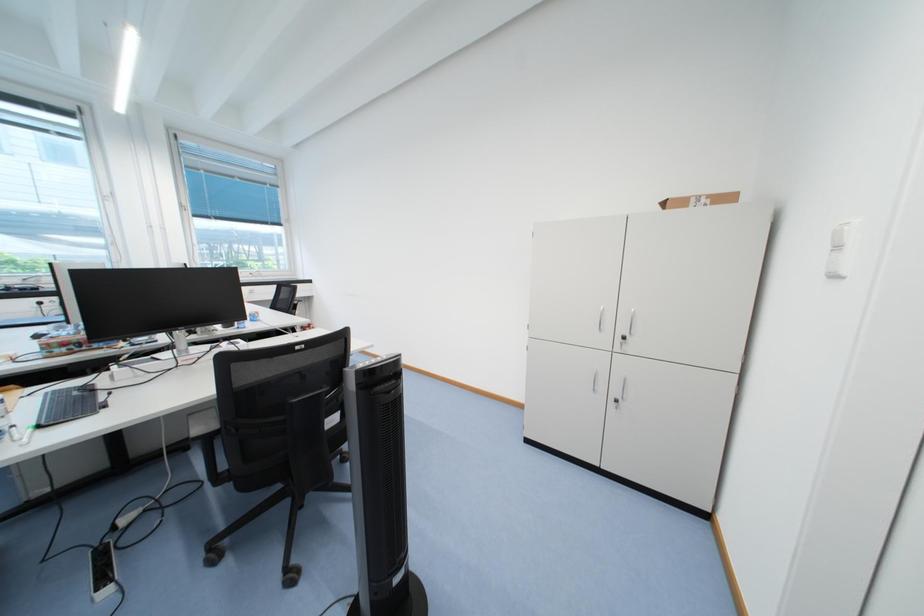
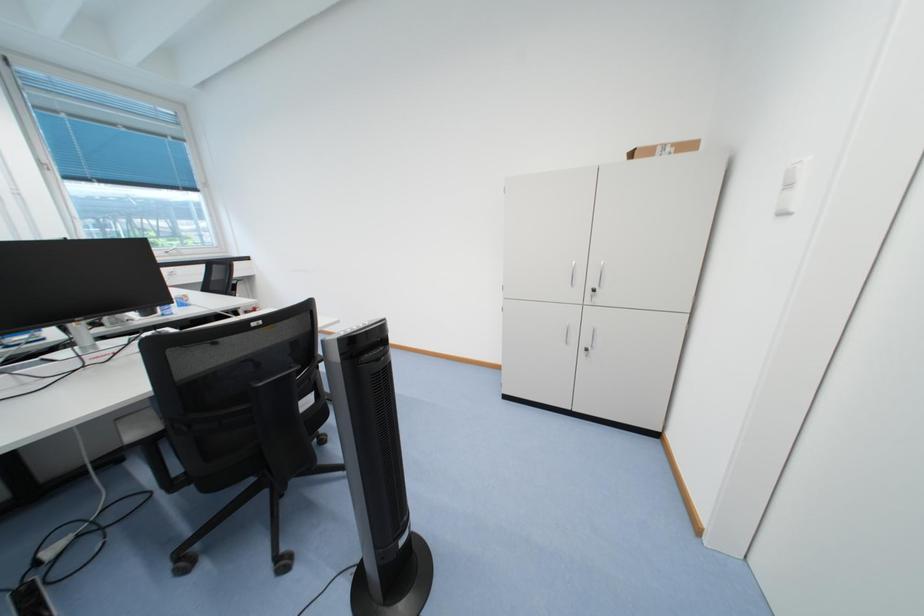
Question: The camera is either moving clockwise (left) or counter-clockwise (right) around the object. The first image is from the beginning of the video and the second image is from the end. Is the camera moving left or right when shooting the video?

Choices:
 (A) Left
 (B) Right

Answer: (A)